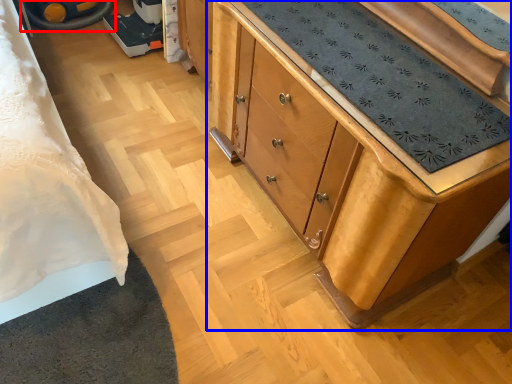
Question: Which point is closer to the camera, wheel (highlighted by a red box) or chest of drawers (highlighted by a blue box)?

Choices:
 (A) wheel
 (B) chest of drawers

Answer: (B)